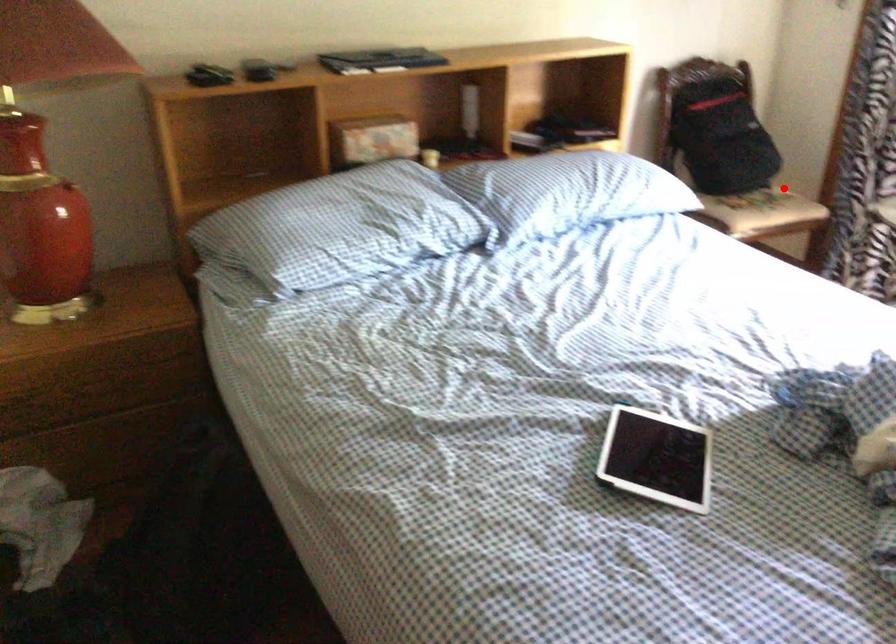
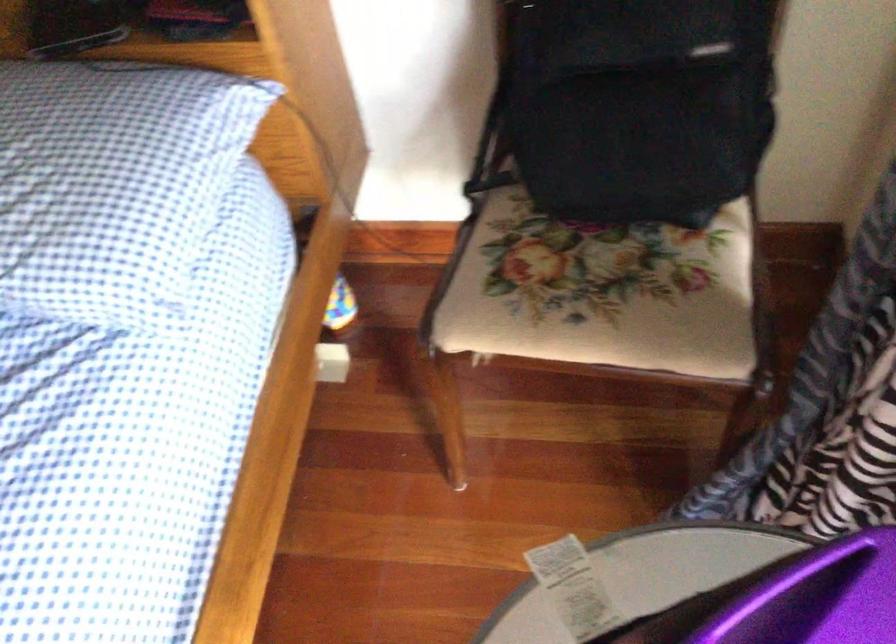
Find the pixel in the second image that matches the highlighted location in the first image.

(599, 292)